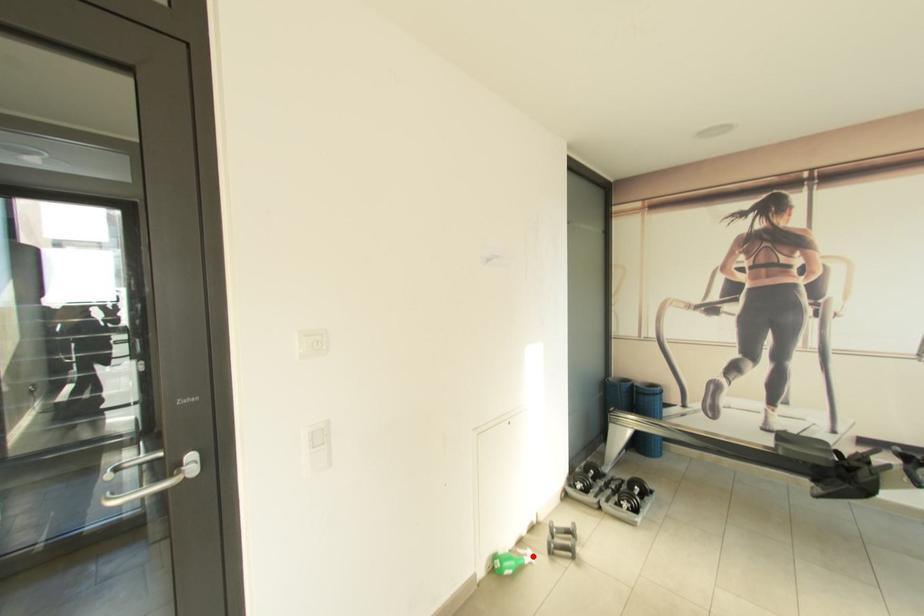
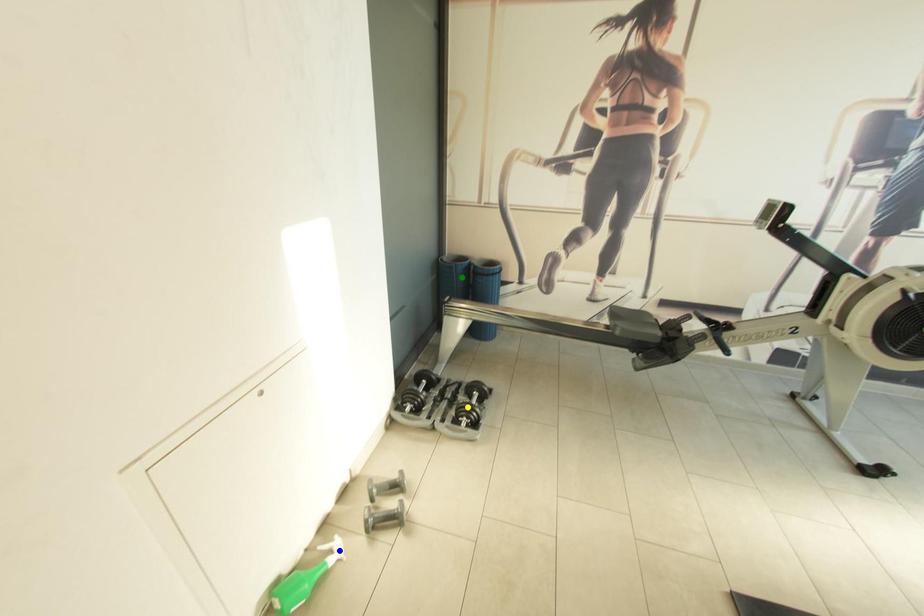
Question: I am providing you with two images of the same scene from different viewpoints. A red point is marked on the first image. You are given multiple points on the second image. Which point in image 2 represents the same 3d spot as the red point in image 1?

Choices:
 (A) blue point
 (B) green point
 (C) yellow point

Answer: (A)